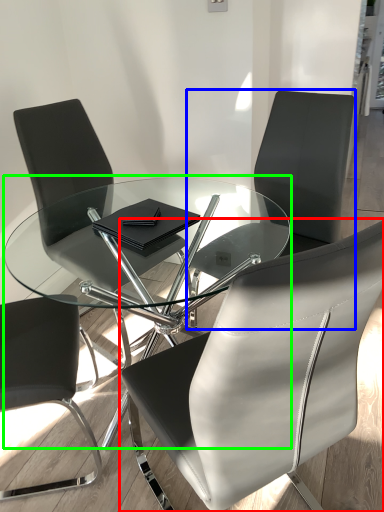
Question: Based on their relative distances, which object is farther from chair (highlighted by a red box)? Choose from chair (highlighted by a blue box) and coffee table (highlighted by a green box).

Choices:
 (A) chair
 (B) coffee table

Answer: (A)